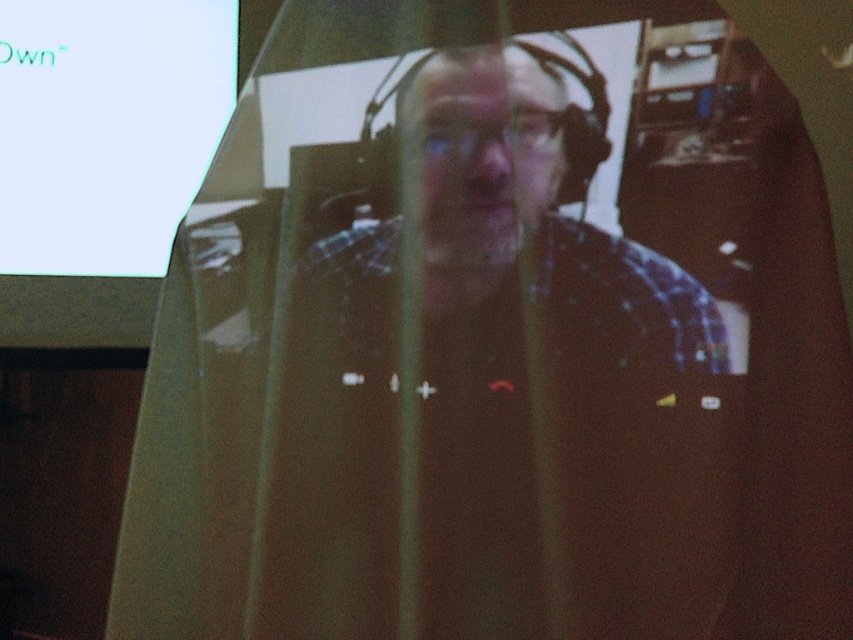
You are standing in the room and want to move from the point at coordinates point (440, 134) to the point at coordinates point (196, 65). Can you walk directly between them without any obstacles?

Point (440, 134) is in front of point (196, 65), so there might be an obstacle between them. Therefore, you cannot walk directly between them without any obstacles.

You are a photographer trying to adjust the lighting for a video call. You notice the plaid shirt at center and the camera are 23.81 inches apart. If the ideal distance between the camera and the subject is 24 inches for optimal lighting, is the current distance sufficient?

The plaid shirt at center and camera are 23.81 inches apart, which is just slightly less than the ideal 24 inches. The distance is almost sufficient, but to meet the exact requirement, moving the camera or subject about 0.19 inches closer would be recommended.